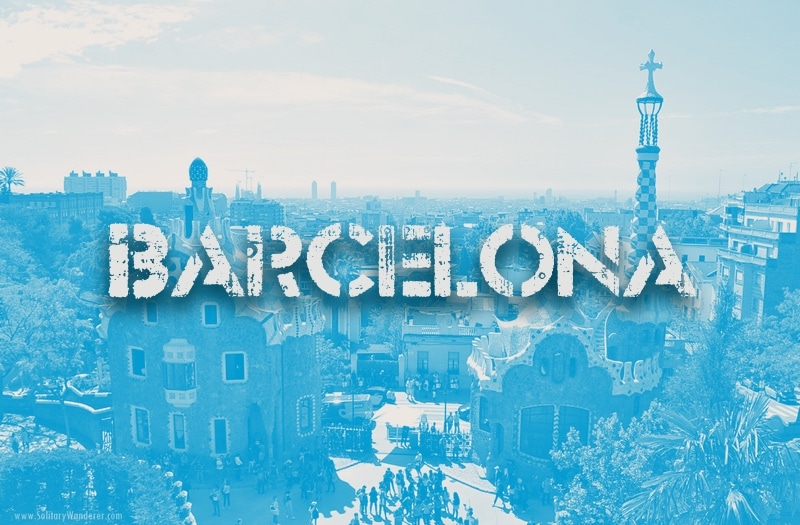
Locate an element on the screen. This screenshot has height=525, width=800. second floor windows is located at coordinates (130, 353), (230, 368).